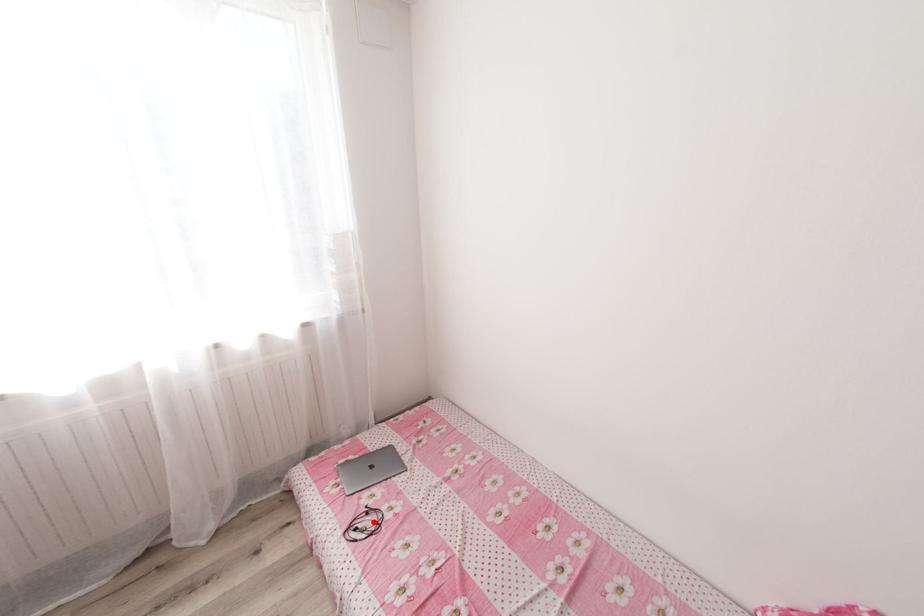
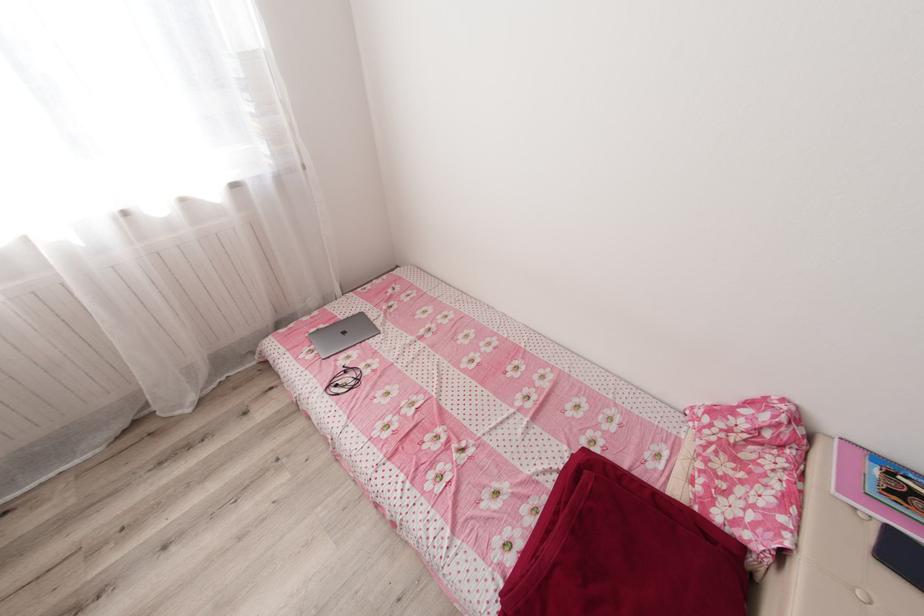
Where in the second image is the point corresponding to the highlighted location from the first image?

(353, 379)